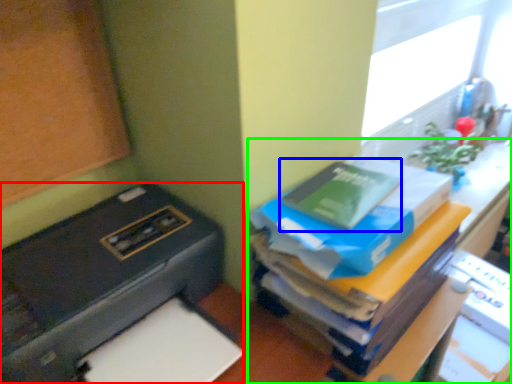
Question: Which object is positioned farthest from printer (highlighted by a red box)? Select from paperback book (highlighted by a blue box) and furniture (highlighted by a green box).

Choices:
 (A) paperback book
 (B) furniture

Answer: (A)